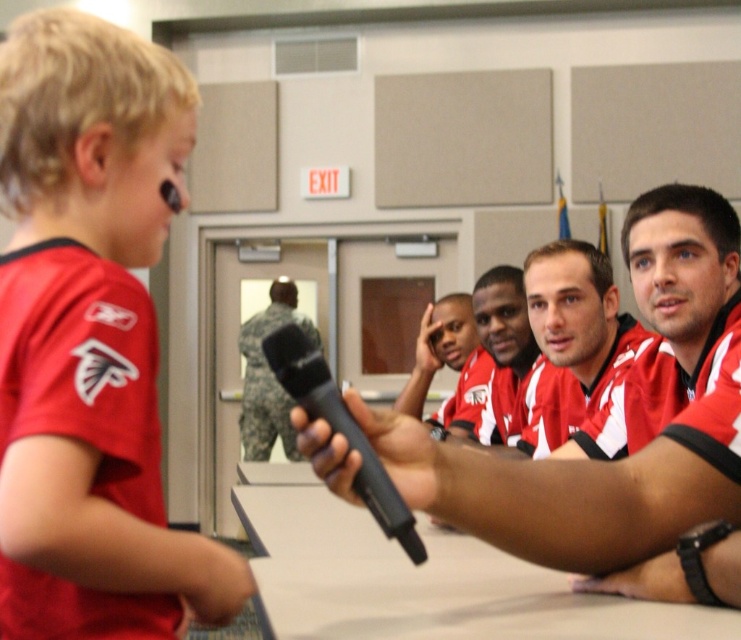
You are a photographer in the conference room. You need to take a photo of both the matte jersey at center and the red jersey at center. Which one should you focus on first if you want to capture both clearly in the same frame?

The matte jersey at center is positioned on the right side of red jersey at center. To capture both clearly, focus on the red jersey at center first since it is closer to the center of the frame, then adjust to include the matte jersey at center on the right.

You are organizing a team photo and need to arrange the matte jersey at center and the red jersey at center based on their positions. According to the scene, which jersey should be placed higher in the photo?

The matte jersey at center should be placed higher in the photo since it is located above the red jersey at center in the scene.

Looking at this image, based on the scene description, where exactly is the camouflage uniform at center located in terms of coordinates?

The camouflage uniform at center is located at point coordinates of (268,376).